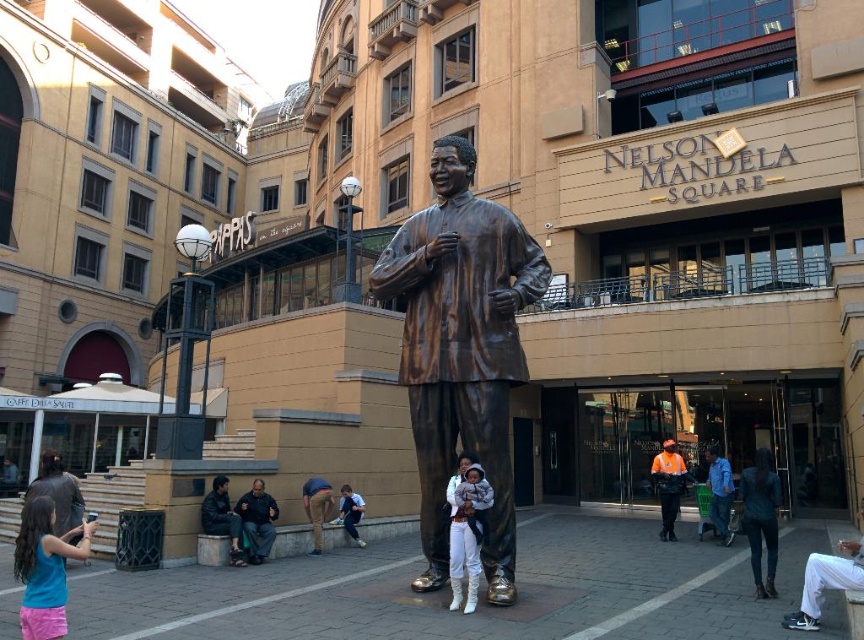
You are a photographer standing near the statue of Nelson Mandela in the plaza. You want to take a photo of the reflective orange vest at center but your camera has a maximum range of 30 meters. Can you capture the vest from your current position?

The reflective orange vest at center and camera are 32.37 meters apart, which exceeds the camera maximum range of 30 meters. Therefore, you cannot capture the vest from your current position.

You are standing at the center of Nelson Mandela Square and see the matte blue tank top at lower left. If you want to walk directly towards it, which direction should you face?

Since the matte blue tank top at lower left is located at point (45,568), you should face towards the lower left direction to walk directly towards it.

You are a photographer trying to capture a clear shot of both the matte blue tank top at lower left and the dark brown leather jacket at lower center. Based on their positions, which clothing item is taller in the photo?

The matte blue tank top at lower left is taller than the dark brown leather jacket at lower center in the photo.